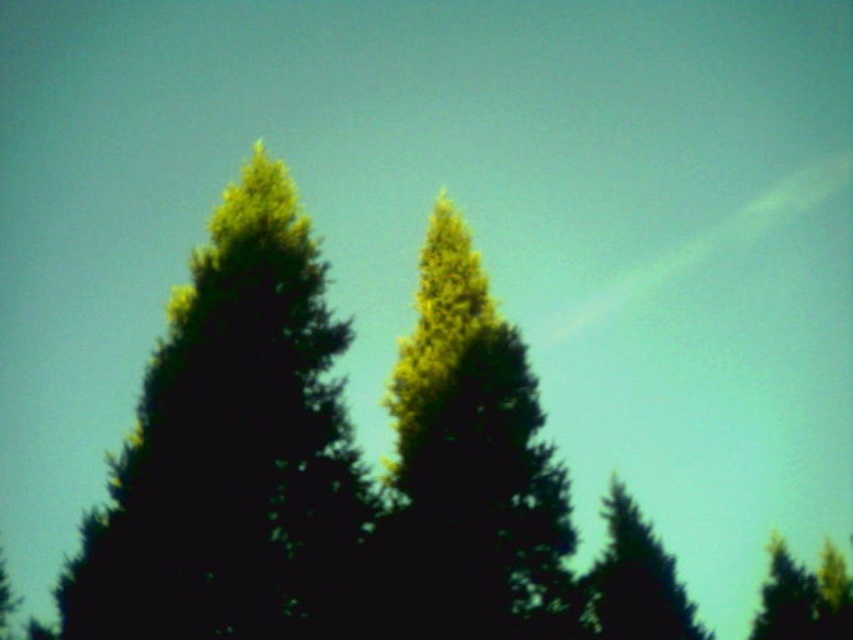
Question: Is green matte fir tree at center positioned before green textured tree at lower right?

Choices:
 (A) no
 (B) yes

Answer: (B)

Question: Considering the real-world distances, which object is farthest from the green matte fir tree at left?

Choices:
 (A) green matte fir tree at center
 (B) green textured tree at lower right
 (C) green matte tree at lower right

Answer: (C)

Question: Which point appears farthest from the camera in this image?

Choices:
 (A) (433, 252)
 (B) (164, 451)
 (C) (830, 614)
 (D) (608, 568)

Answer: (C)

Question: From the image, what is the correct spatial relationship of green matte fir tree at left in relation to green matte tree at lower right?

Choices:
 (A) above
 (B) below

Answer: (A)

Question: Which is nearer to the green matte tree at lower right?

Choices:
 (A) green matte fir tree at center
 (B) green matte fir tree at left
 (C) green textured tree at lower right

Answer: (C)

Question: Can you confirm if green matte fir tree at center is smaller than green matte tree at lower right?

Choices:
 (A) no
 (B) yes

Answer: (B)